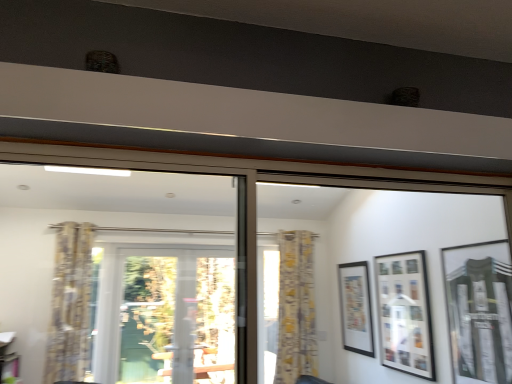
Question: Can you confirm if transparent glass screen door at center is smaller than matte black picture frame at center right, which ranks as the first picture frame in left-to-right order?

Choices:
 (A) no
 (B) yes

Answer: (A)

Question: Does transparent glass screen door at center appear on the right side of matte black picture frame at center right, marked as the third picture frame in a front-to-back arrangement?

Choices:
 (A) no
 (B) yes

Answer: (A)

Question: From the image's perspective, is transparent glass screen door at center above matte black picture frame at center right, marked as the third picture frame in a front-to-back arrangement?

Choices:
 (A) no
 (B) yes

Answer: (A)

Question: From a real-world perspective, is transparent glass screen door at center located beneath matte black picture frame at center right, which ranks as the first picture frame in left-to-right order?

Choices:
 (A) yes
 (B) no

Answer: (A)

Question: Is transparent glass screen door at center further to the viewer compared to matte black picture frame at center right, the 3th picture frame in the right-to-left sequence?

Choices:
 (A) yes
 (B) no

Answer: (A)

Question: Is transparent glass screen door at center completely or partially outside of matte black picture frame at center right, marked as the third picture frame in a front-to-back arrangement?

Choices:
 (A) no
 (B) yes

Answer: (B)

Question: From the image's perspective, is yellow floral fabric curtain at center, placed as the 1th curtain when sorted from back to front, located beneath transparent glass screen door at center?

Choices:
 (A) no
 (B) yes

Answer: (A)

Question: Considering the relative positions of yellow floral fabric curtain at center, the second curtain viewed from the front, and transparent glass screen door at center in the image provided, is yellow floral fabric curtain at center, the second curtain viewed from the front, to the left of transparent glass screen door at center from the viewer's perspective?

Choices:
 (A) no
 (B) yes

Answer: (A)

Question: Would you say transparent glass screen door at center is part of yellow floral fabric curtain at center, placed as the 1th curtain when sorted from back to front,'s contents?

Choices:
 (A) no
 (B) yes

Answer: (A)

Question: Does yellow floral fabric curtain at center, the second curtain viewed from the front, lie behind transparent glass screen door at center?

Choices:
 (A) yes
 (B) no

Answer: (A)

Question: From the image's perspective, is yellow floral fabric curtain at center, placed as the 1th curtain when sorted from back to front, above transparent glass screen door at center?

Choices:
 (A) no
 (B) yes

Answer: (B)

Question: Does yellow floral fabric curtain at center, placed as the 2th curtain when sorted from left to right, have a lesser height compared to transparent glass screen door at center?

Choices:
 (A) yes
 (B) no

Answer: (B)

Question: Is matte black picture frame at center right, marked as the third picture frame in a front-to-back arrangement, thinner than matte glass picture frame at right, which is the first picture frame from front to back?

Choices:
 (A) yes
 (B) no

Answer: (A)